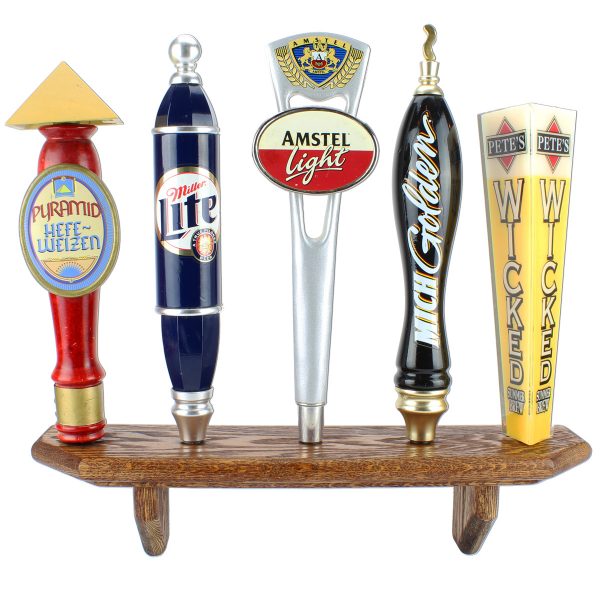
The height and width of the screenshot is (600, 600). I want to click on handle, so click(78, 349), click(183, 339), click(322, 350), click(435, 362), click(528, 352).